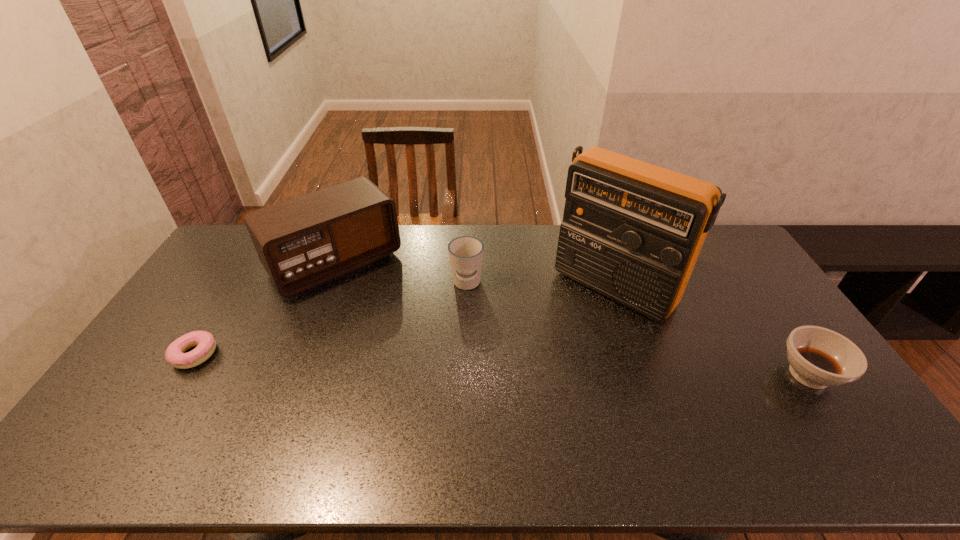
Where is `the leftmost object`? The width and height of the screenshot is (960, 540). the leftmost object is located at coordinates (175, 354).

What are the coordinates of `the shortest object` in the screenshot? It's located at (175, 354).

Locate an element on the screen. the rightmost object is located at coordinates (819, 357).

Where is `the second shortest object`? The image size is (960, 540). the second shortest object is located at coordinates (819, 357).

Image resolution: width=960 pixels, height=540 pixels. Find the location of `cup`. cup is located at coordinates (466, 252).

Locate an element on the screen. The height and width of the screenshot is (540, 960). the third object from left to right is located at coordinates (466, 252).

What are the coordinates of `the second object from right to left` in the screenshot? It's located at (632, 231).

Where is `the right radio receiver`? The image size is (960, 540). the right radio receiver is located at coordinates (632, 231).

This screenshot has width=960, height=540. I want to click on the shorter radio receiver, so click(302, 242).

Locate an element on the screen. the second object from left to right is located at coordinates (302, 242).